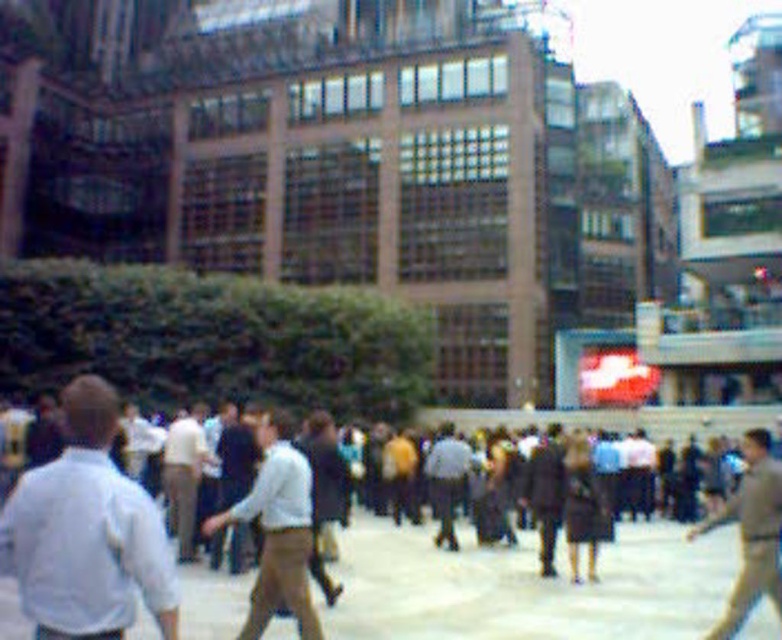
In the scene shown: You are standing in the bustling urban scene and want to take a photo of both the modern building with large windows and the curved glass and steel building. You notice two points marked on your map as potential vantage points. The first point is at coordinate point (300, 580), and the second is at point (768, 528). Which point is closer to you, the observer?

Point (768, 528) is closer to you because point (300, 580) is behind it.

In the scene shown: You are a photographer trying to capture a shot of the light brown leather jacket at center without the brown fabric crowd at center blocking it. Is the crowd wider than the jacket?

The brown fabric crowd at center is wider than the light brown leather jacket at center, so the crowd is wider and may block the jacket.

You are a photographer standing in the crowd and want to take a photo of the light brown leather jacket at center and the light beige pants at center. Which one should you focus on first to ensure both are in sharp focus?

You should focus on the light brown leather jacket at center first because it is closer to you than the light beige pants at center, so adjusting focus from near to far will help both be in sharp focus.